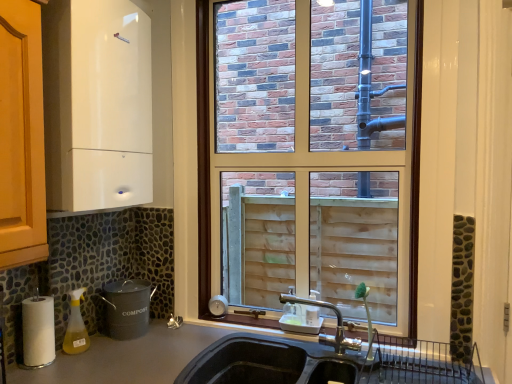
Image resolution: width=512 pixels, height=384 pixels. What are the coordinates of `gray matte compost bin at lower left, which ranks as the 3th appliance in top-to-bottom order` in the screenshot? It's located at (127, 308).

Describe the element at coordinates (97, 104) in the screenshot. I see `white glossy boiler at upper left, the first appliance when ordered from top to bottom` at that location.

The width and height of the screenshot is (512, 384). Describe the element at coordinates (336, 327) in the screenshot. I see `gold metallic faucet at center` at that location.

This screenshot has height=384, width=512. Describe the element at coordinates (203, 157) in the screenshot. I see `matte glass window at center` at that location.

The image size is (512, 384). I want to click on gray matte compost bin at lower left, the 1th appliance positioned from the bottom, so click(x=127, y=308).

Is white paper towel at lower left, arranged as the second appliance when viewed from the top, positioned beyond the bounds of matte glass window at center?

Yes.

Considering the sizes of objects white paper towel at lower left, arranged as the second appliance when viewed from the top, and matte glass window at center in the image provided, who is taller, white paper towel at lower left, arranged as the second appliance when viewed from the top, or matte glass window at center?

With more height is matte glass window at center.

Can you tell me how much white paper towel at lower left, placed as the second appliance when sorted from bottom to top, and matte glass window at center differ in facing direction?

90 degrees.

Could you tell me if white paper towel at lower left, placed as the second appliance when sorted from bottom to top, is facing matte glass window at center?

No, white paper towel at lower left, placed as the second appliance when sorted from bottom to top, is not aimed at matte glass window at center.

Can you confirm if gold metallic faucet at center is bigger than white paper towel at lower left, arranged as the second appliance when viewed from the top?

Correct, gold metallic faucet at center is larger in size than white paper towel at lower left, arranged as the second appliance when viewed from the top.

Are gold metallic faucet at center and white paper towel at lower left, arranged as the second appliance when viewed from the top, far apart?

Yes, gold metallic faucet at center is far from white paper towel at lower left, arranged as the second appliance when viewed from the top.

Does gold metallic faucet at center appear on the right side of white paper towel at lower left, placed as the second appliance when sorted from bottom to top?

Yes.

Which object is closer to the camera, gold metallic faucet at center or yellow translucent spray bottle at lower left?

gold metallic faucet at center is more forward.

Considering the sizes of gold metallic faucet at center and yellow translucent spray bottle at lower left in the image, is gold metallic faucet at center wider or thinner than yellow translucent spray bottle at lower left?

Clearly, gold metallic faucet at center has more width compared to yellow translucent spray bottle at lower left.

Would you say gold metallic faucet at center contains yellow translucent spray bottle at lower left?

No, yellow translucent spray bottle at lower left is not surrounded by gold metallic faucet at center.

From a real-world perspective, is white glossy boiler at upper left, the first appliance when ordered from top to bottom, on top of gray matte compost bin at lower left, the 1th appliance positioned from the bottom?

Yes, from a real-world perspective, white glossy boiler at upper left, the first appliance when ordered from top to bottom, is on top of gray matte compost bin at lower left, the 1th appliance positioned from the bottom.

Is white glossy boiler at upper left, marked as the 3th appliance in a bottom-to-top arrangement, in front of or behind gray matte compost bin at lower left, which ranks as the 3th appliance in top-to-bottom order, in the image?

white glossy boiler at upper left, marked as the 3th appliance in a bottom-to-top arrangement, is in front of gray matte compost bin at lower left, which ranks as the 3th appliance in top-to-bottom order.

How many degrees apart are the facing directions of white glossy boiler at upper left, marked as the 3th appliance in a bottom-to-top arrangement, and gray matte compost bin at lower left, which ranks as the 3th appliance in top-to-bottom order?

They differ by 0.000578 degrees in their facing directions.

Does white glossy boiler at upper left, marked as the 3th appliance in a bottom-to-top arrangement, have a larger size compared to gray matte compost bin at lower left, which ranks as the 3th appliance in top-to-bottom order?

Yes, white glossy boiler at upper left, marked as the 3th appliance in a bottom-to-top arrangement, is bigger than gray matte compost bin at lower left, which ranks as the 3th appliance in top-to-bottom order.

Considering the relative sizes of white glossy boiler at upper left, the first appliance when ordered from top to bottom, and matte glass window at center in the image provided, is white glossy boiler at upper left, the first appliance when ordered from top to bottom, thinner than matte glass window at center?

In fact, white glossy boiler at upper left, the first appliance when ordered from top to bottom, might be wider than matte glass window at center.

Between white glossy boiler at upper left, the first appliance when ordered from top to bottom, and matte glass window at center, which one has more height?

matte glass window at center.

Considering the positions of objects white glossy boiler at upper left, the first appliance when ordered from top to bottom, and matte glass window at center in the image provided, who is more to the right, white glossy boiler at upper left, the first appliance when ordered from top to bottom, or matte glass window at center?

Positioned to the right is matte glass window at center.

Could you tell me if white glossy boiler at upper left, the first appliance when ordered from top to bottom, is facing matte glass window at center?

Yes.

Image resolution: width=512 pixels, height=384 pixels. In order to click on countertop lying on the right of yellow translucent spray bottle at lower left in this screenshot , I will do `click(152, 351)`.

In the scene shown: Between yellow translucent spray bottle at lower left and smooth gray countertop at lower left, which one has less height?

With less height is yellow translucent spray bottle at lower left.

Is yellow translucent spray bottle at lower left next to smooth gray countertop at lower left and touching it?

No, yellow translucent spray bottle at lower left is not beside smooth gray countertop at lower left.

Can you confirm if yellow translucent spray bottle at lower left is positioned to the left of smooth gray countertop at lower left?

Yes, yellow translucent spray bottle at lower left is to the left of smooth gray countertop at lower left.

Is white paper towel at lower left, arranged as the second appliance when viewed from the top, located within yellow translucent spray bottle at lower left?

That's incorrect, white paper towel at lower left, arranged as the second appliance when viewed from the top, is not inside yellow translucent spray bottle at lower left.

Considering the relative sizes of yellow translucent spray bottle at lower left and white paper towel at lower left, arranged as the second appliance when viewed from the top, in the image provided, is yellow translucent spray bottle at lower left shorter than white paper towel at lower left, arranged as the second appliance when viewed from the top,?

Indeed, yellow translucent spray bottle at lower left has a lesser height compared to white paper towel at lower left, arranged as the second appliance when viewed from the top.

Identify the location of bottle located on the right of white paper towel at lower left, placed as the second appliance when sorted from bottom to top. The height and width of the screenshot is (384, 512). (76, 326).

From the matte glass window at center, count 1st appliances forward and point to it. Please provide its 2D coordinates.

[(38, 331)]

At what (x,y) coordinates should I click in order to perform the action: click on the 1st appliance behind the gold metallic faucet at center, counting from the anchor's position. Please return your answer as a coordinate pair (x, y). Looking at the image, I should click on [x=38, y=331].

Based on their spatial positions, is white paper towel at lower left, arranged as the second appliance when viewed from the top, or yellow translucent spray bottle at lower left further from smooth gray countertop at lower left?

white paper towel at lower left, arranged as the second appliance when viewed from the top, is further to smooth gray countertop at lower left.

Which object lies nearer to the anchor point smooth gray countertop at lower left, gold metallic faucet at center or matte glass window at center?

matte glass window at center.

Looking at the image, which one is located closer to matte glass window at center, gray matte compost bin at lower left, the 1th appliance positioned from the bottom, or white glossy boiler at upper left, the first appliance when ordered from top to bottom?

gray matte compost bin at lower left, the 1th appliance positioned from the bottom.

Considering their positions, is white paper towel at lower left, placed as the second appliance when sorted from bottom to top, positioned closer to matte glass window at center than gold metallic faucet at center?

gold metallic faucet at center is closer to matte glass window at center.

Which object lies further to the anchor point smooth gray countertop at lower left, gray matte compost bin at lower left, the 1th appliance positioned from the bottom, or white paper towel at lower left, placed as the second appliance when sorted from bottom to top?

white paper towel at lower left, placed as the second appliance when sorted from bottom to top.

Based on the photo, based on their spatial positions, is yellow translucent spray bottle at lower left or gray matte compost bin at lower left, which ranks as the 3th appliance in top-to-bottom order, further from gold metallic faucet at center?

yellow translucent spray bottle at lower left is positioned further to the anchor gold metallic faucet at center.

Consider the image. From the image, which object appears to be nearer to gold metallic faucet at center, matte glass window at center or gray matte compost bin at lower left, the 1th appliance positioned from the bottom?

matte glass window at center lies closer to gold metallic faucet at center than the other object.

Which object lies nearer to the anchor point gold metallic faucet at center, smooth gray countertop at lower left or gray matte compost bin at lower left, the 1th appliance positioned from the bottom?

Based on the image, smooth gray countertop at lower left appears to be nearer to gold metallic faucet at center.

I want to click on bottle between white glossy boiler at upper left, marked as the 3th appliance in a bottom-to-top arrangement, and smooth gray countertop at lower left vertically, so [76, 326].

Where is `tap that lies between white glossy boiler at upper left, the first appliance when ordered from top to bottom, and gray matte compost bin at lower left, which ranks as the 3th appliance in top-to-bottom order, from top to bottom`? Image resolution: width=512 pixels, height=384 pixels. tap that lies between white glossy boiler at upper left, the first appliance when ordered from top to bottom, and gray matte compost bin at lower left, which ranks as the 3th appliance in top-to-bottom order, from top to bottom is located at coordinates (336, 327).

This screenshot has height=384, width=512. I want to click on window located between yellow translucent spray bottle at lower left and gold metallic faucet at center in the left-right direction, so click(x=203, y=157).

Find the location of a particular element. This screenshot has height=384, width=512. tap between matte glass window at center and smooth gray countertop at lower left vertically is located at coordinates (336, 327).